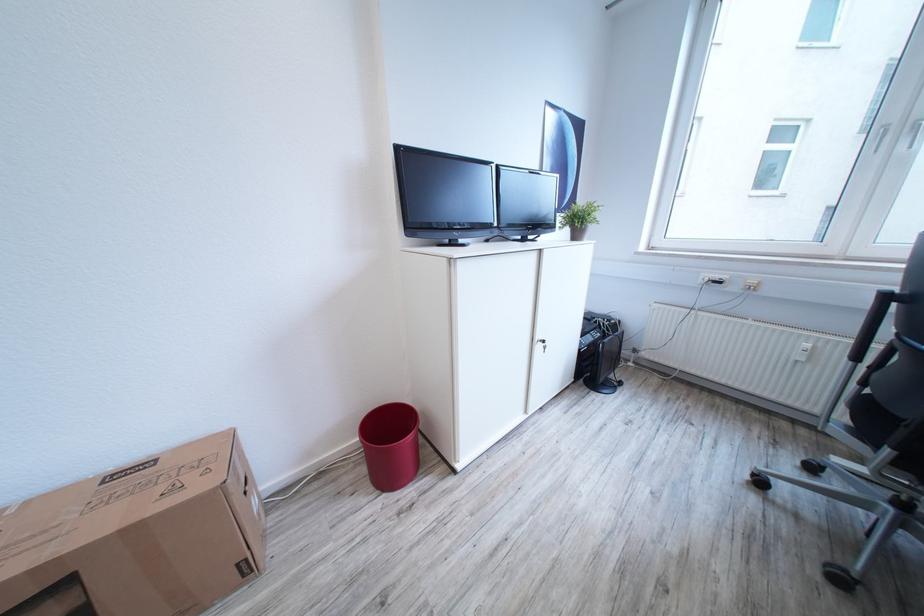
This screenshot has height=616, width=924. Describe the element at coordinates (541, 344) in the screenshot. I see `a cabinet key` at that location.